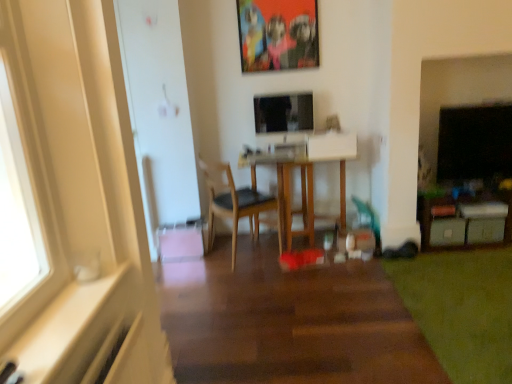
Locate an element on the screen. This screenshot has width=512, height=384. vacant area in front of green matte drawer at lower right, which ranks as the first drawer in left-to-right order is located at coordinates (455, 253).